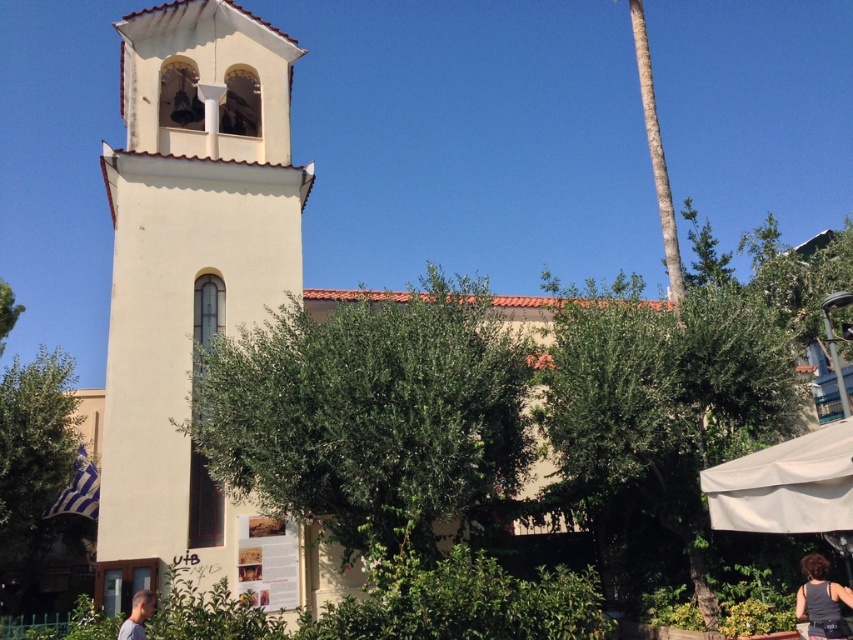
Does black fabric tank top at lower right appear over blonde hair at lower left?

No.

Who is more forward, (x=822, y=628) or (x=136, y=593)?

Point (x=822, y=628)

Does point (817, 625) come in front of point (144, 611)?

No, it is behind (144, 611).

I want to click on black fabric tank top at lower right, so click(821, 600).

Does white stucco bell tower at left have a lesser height compared to green textured palm tree at upper right?

Correct, white stucco bell tower at left is not as tall as green textured palm tree at upper right.

Does white stucco bell tower at left have a lesser width compared to green textured palm tree at upper right?

Yes.

Is point (140, 124) in front of point (637, 51)?

Yes.

Where is `white stucco bell tower at left`? The width and height of the screenshot is (853, 640). white stucco bell tower at left is located at coordinates (192, 282).

Measure the distance between white stucco church at center and camera.

white stucco church at center and camera are 8.30 meters apart.

Is point (201, 218) closer to camera compared to point (761, 528)?

No, (201, 218) is further to viewer.

You are a GUI agent. You are given a task and a screenshot of the screen. Output one action in this format:
    pyautogui.click(x=<x>, y=<y>)
    Task: Click on the white stucco church at center
    This screenshot has height=640, width=853.
    Given the screenshot: What is the action you would take?
    pyautogui.click(x=199, y=296)